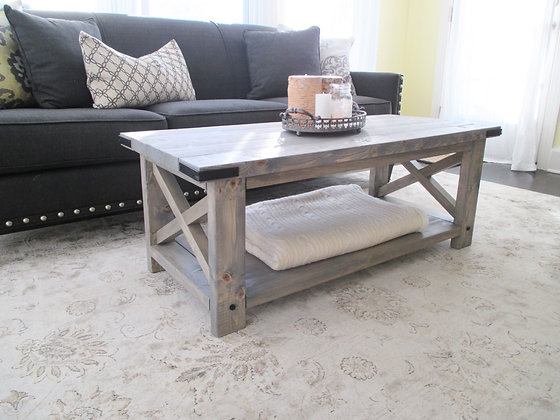
Locate an element on the screen. curtains is located at coordinates (526, 48), (353, 16).